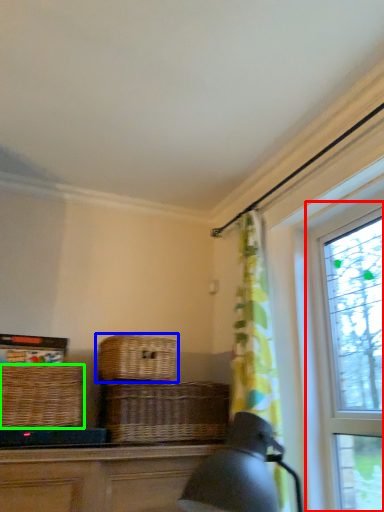
Question: Which object is positioned farthest from window (highlighted by a red box)? Select from picnic basket (highlighted by a blue box) and picnic basket (highlighted by a green box).

Choices:
 (A) picnic basket
 (B) picnic basket

Answer: (B)